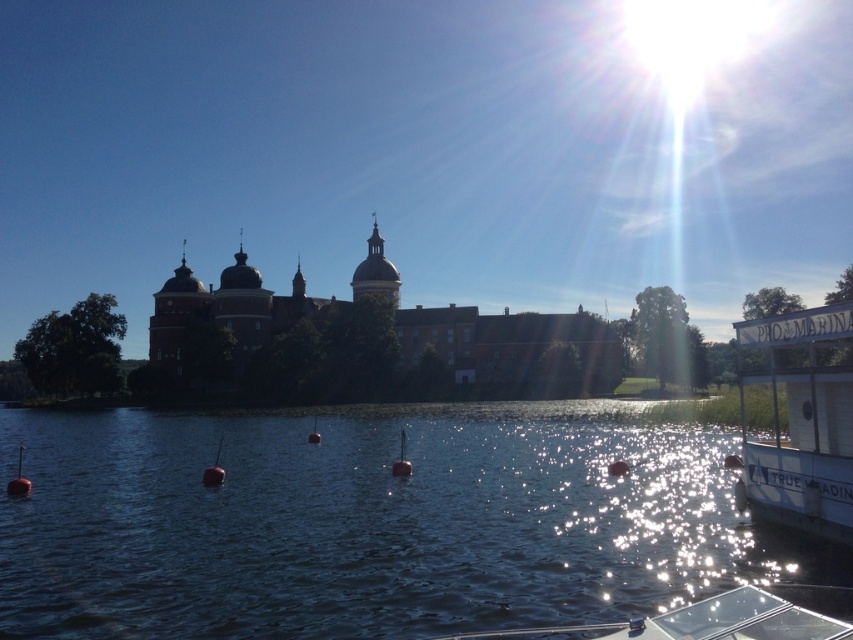
Can you confirm if smooth red buoy at lower left is taller than red buoy at lower left?

Incorrect, smooth red buoy at lower left's height is not larger of red buoy at lower left's.

This screenshot has width=853, height=640. Find the location of `smooth red buoy at lower left`. smooth red buoy at lower left is located at coordinates (18, 480).

The width and height of the screenshot is (853, 640). Find the location of `smooth red buoy at lower left`. smooth red buoy at lower left is located at coordinates (18, 480).

This screenshot has height=640, width=853. Identify the location of dark blue water at center. (368, 524).

Can you confirm if dark blue water at center is thinner than metallic silver buoy at center?

Incorrect, dark blue water at center's width is not less than metallic silver buoy at center's.

Does point (393, 566) come in front of point (399, 451)?

That is True.

This screenshot has height=640, width=853. Find the location of `dark blue water at center`. dark blue water at center is located at coordinates (368, 524).

Is metallic silver buoy at center behind red buoy at lower left?

No, metallic silver buoy at center is closer to the viewer.

Is point (395, 472) closer to camera compared to point (312, 432)?

That is True.

Locate an element on the screen. The height and width of the screenshot is (640, 853). metallic silver buoy at center is located at coordinates (401, 460).